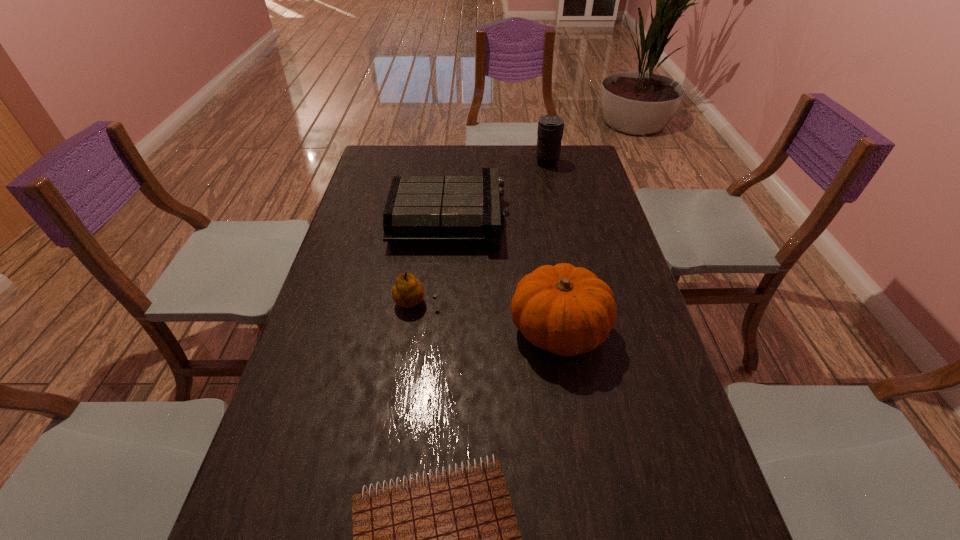
Where is `object that is positioned at the far edge`? This screenshot has width=960, height=540. object that is positioned at the far edge is located at coordinates (550, 127).

Where is `object that is at the left edge`? This screenshot has width=960, height=540. object that is at the left edge is located at coordinates (419, 208).

Locate an element on the screen. This screenshot has height=540, width=960. telephoto lens located in the right edge section of the desktop is located at coordinates (550, 127).

You are a GUI agent. You are given a task and a screenshot of the screen. Output one action in this format:
    pyautogui.click(x=<x>, y=<y>)
    Task: Click on the pumpkin positioned at the right edge
    
    Given the screenshot: What is the action you would take?
    567,310

The image size is (960, 540). What are the coordinates of `object that is at the far right corner` in the screenshot? It's located at (550, 127).

Identify the location of free space at the far edge of the desktop. The image size is (960, 540). (543, 169).

Image resolution: width=960 pixels, height=540 pixels. In order to click on blank space at the left edge of the desktop in this screenshot , I will do `click(371, 181)`.

The image size is (960, 540). In the image, there is a desktop. In order to click on vacant space at the right edge in this screenshot , I will do `click(612, 383)`.

Where is `free space at the far right corner of the desktop`? This screenshot has height=540, width=960. free space at the far right corner of the desktop is located at coordinates (595, 168).

Find the location of a particular element. free spot between the fourth nearest object and the pear is located at coordinates (432, 261).